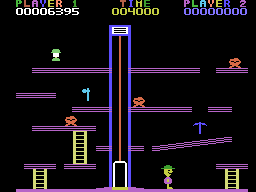
You are a GUI agent. You are given a task and a screenshot of the screen. Output one action in this format:
    pyautogui.click(x=<x>, y=<y>)
    Task: Click on the ladder
    
    Given the screenshot: What is the action you would take?
    pyautogui.click(x=230, y=180), pyautogui.click(x=40, y=177), pyautogui.click(x=77, y=146)